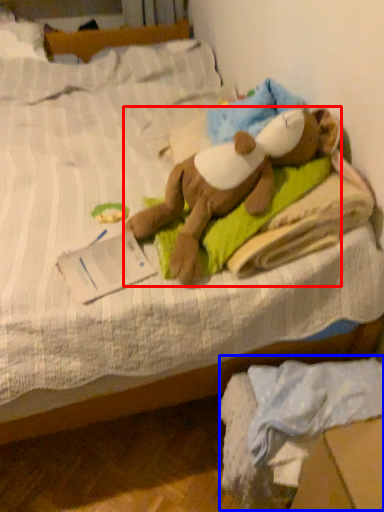
Question: Which object is further to the camera taking this photo, person (highlighted by a red box) or material (highlighted by a blue box)?

Choices:
 (A) person
 (B) material

Answer: (A)